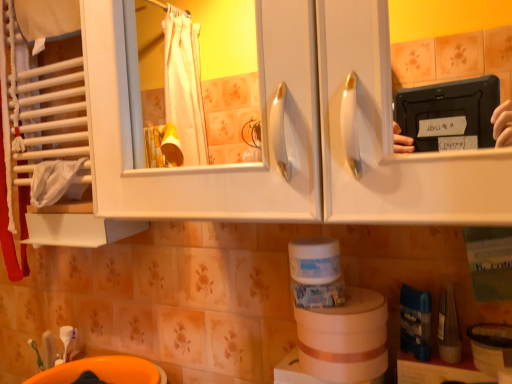
Question: Could you tell me if beige cardboard roll at lower center, the 2th toilet paper viewed from the top, is facing orange plastic sink at lower left?

Choices:
 (A) yes
 (B) no

Answer: (B)

Question: Is beige cardboard roll at lower center, the 2th toilet paper viewed from the top, shorter than orange plastic sink at lower left?

Choices:
 (A) yes
 (B) no

Answer: (A)

Question: From the image's perspective, is beige cardboard roll at lower center, the 2th toilet paper viewed from the top, above orange plastic sink at lower left?

Choices:
 (A) no
 (B) yes

Answer: (B)

Question: Could orange plastic sink at lower left be considered to be inside beige cardboard roll at lower center, which is the 1th toilet paper in bottom-to-top order?

Choices:
 (A) yes
 (B) no

Answer: (B)

Question: Does beige cardboard roll at lower center, which is the 1th toilet paper in bottom-to-top order, appear on the left side of orange plastic sink at lower left?

Choices:
 (A) yes
 (B) no

Answer: (B)

Question: In terms of size, does beige cardboard roll at lower center, which is the 1th toilet paper in bottom-to-top order, appear bigger or smaller than white matte container at center, the 1th toilet paper viewed from the top?

Choices:
 (A) big
 (B) small

Answer: (A)

Question: Is beige cardboard roll at lower center, the 2th toilet paper viewed from the top, inside or outside of white matte container at center, the 1th toilet paper viewed from the top?

Choices:
 (A) inside
 (B) outside

Answer: (B)

Question: Is beige cardboard roll at lower center, the 2th toilet paper viewed from the top, taller or shorter than white matte container at center, marked as the second toilet paper in a bottom-to-top arrangement?

Choices:
 (A) short
 (B) tall

Answer: (B)

Question: From the image's perspective, is beige cardboard roll at lower center, which is the 1th toilet paper in bottom-to-top order, above or below white matte container at center, the 1th toilet paper viewed from the top?

Choices:
 (A) above
 (B) below

Answer: (B)

Question: Is beige cardboard roll at lower center, which is the 1th toilet paper in bottom-to-top order, in front of or behind orange plastic sink at lower left in the image?

Choices:
 (A) front
 (B) behind

Answer: (A)

Question: From a real-world perspective, relative to orange plastic sink at lower left, is beige cardboard roll at lower center, the 2th toilet paper viewed from the top, vertically above or below?

Choices:
 (A) above
 (B) below

Answer: (A)

Question: Is beige cardboard roll at lower center, the 2th toilet paper viewed from the top, taller or shorter than orange plastic sink at lower left?

Choices:
 (A) tall
 (B) short

Answer: (B)

Question: In terms of width, does beige cardboard roll at lower center, the 2th toilet paper viewed from the top, look wider or thinner when compared to orange plastic sink at lower left?

Choices:
 (A) wide
 (B) thin

Answer: (B)

Question: Is orange plastic sink at lower left to the left or to the right of white matte container at center, marked as the second toilet paper in a bottom-to-top arrangement, in the image?

Choices:
 (A) right
 (B) left

Answer: (B)

Question: Is point (140, 374) positioned closer to the camera than point (288, 261)?

Choices:
 (A) farther
 (B) closer

Answer: (A)